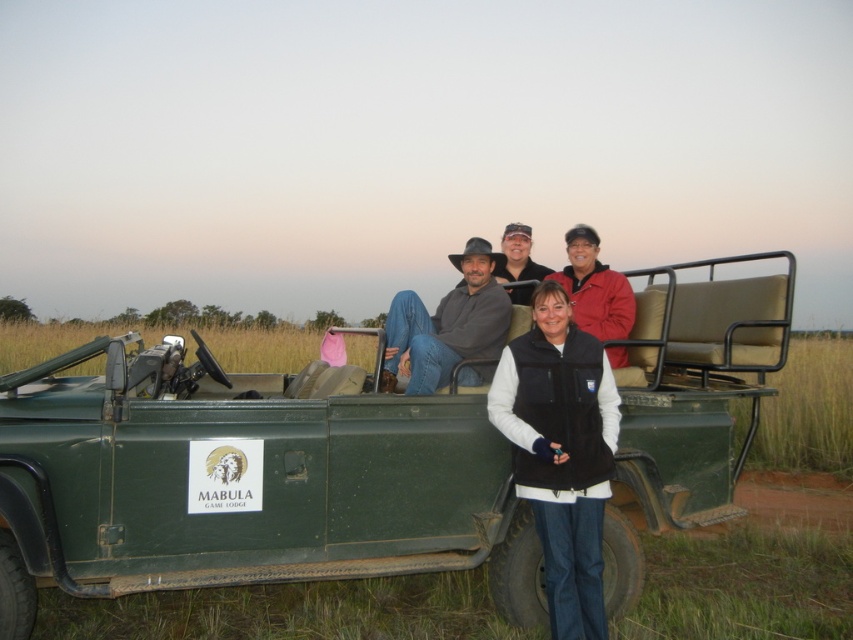
You are a photographer trying to capture a clear shot of the black fleece vest at center and the matte gray hat at center. Since both are at the same position, you need to adjust your focus. Which object should you focus on first if you want to ensure both are in focus, considering their sizes?

The black fleece vest at center is taller than the matte gray hat at center. To ensure both are in focus, focus on the black fleece vest at center first as it is larger and requires more precise focusing.

You are a photographer trying to capture a closeup of the black fleece vest at center and the matte gray hat at center in the same frame. Given that your camera has a maximum focus range of 2 meters, will you be able to include both items in the shot?

The black fleece vest at center and matte gray hat at center are 2.30 meters apart from each other. Since the camera can only focus within 2 meters, the distance between them exceeds the maximum focus range. Therefore, you won technical difficulties in capturing both items clearly in the same frame.